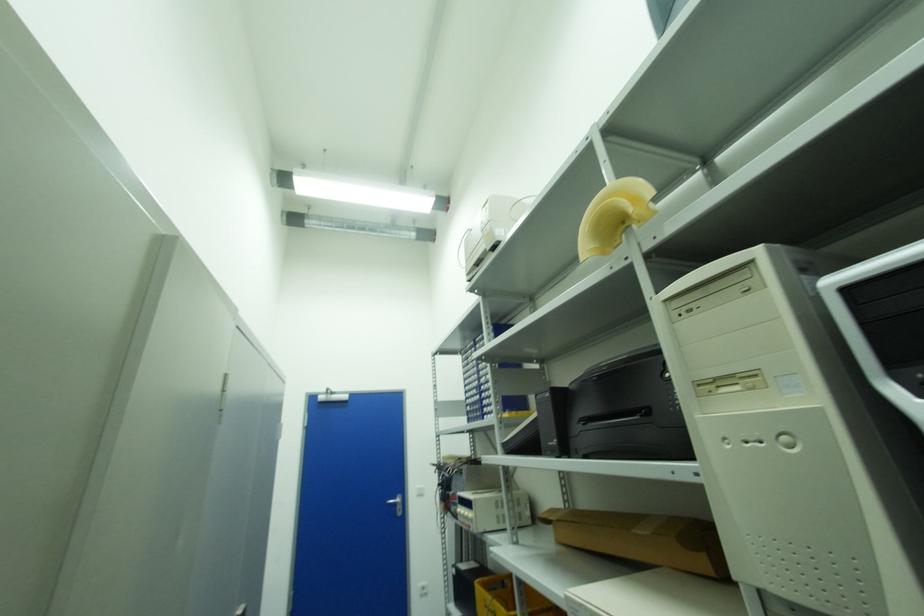
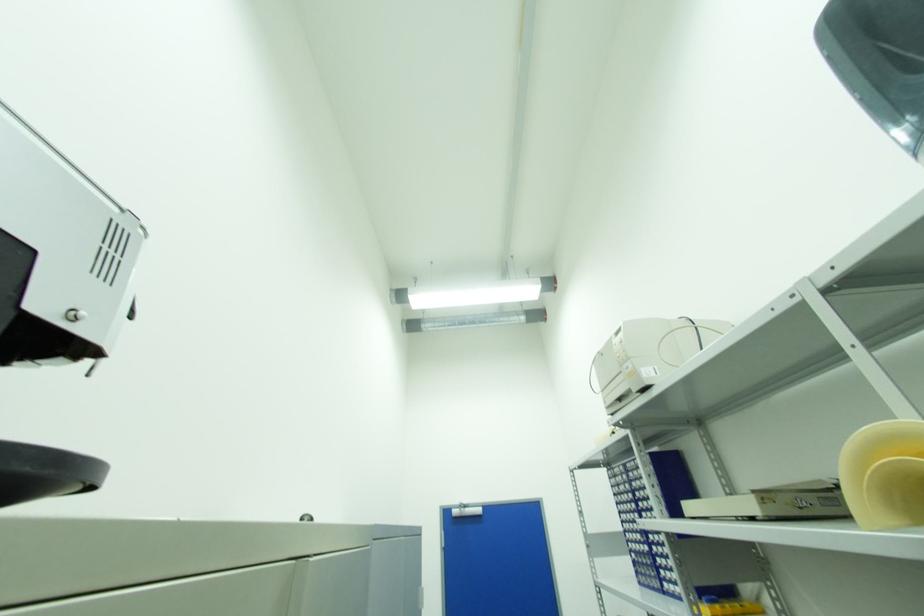
Question: What movement of the cameraman would produce the second image?

Choices:
 (A) Left
 (B) Right
 (C) Forward
 (D) Backward

Answer: (C)